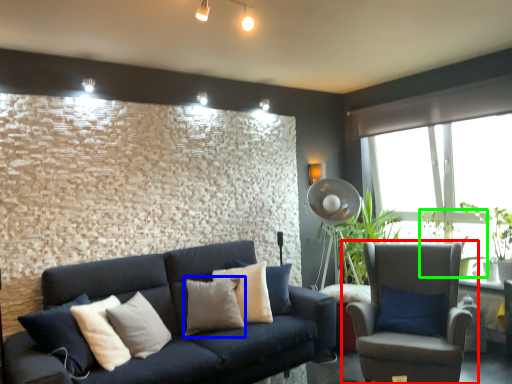
Question: Considering the real-world distances, which object is farthest from chair (highlighted by a red box)? pillow (highlighted by a blue box) or plant (highlighted by a green box)?

Choices:
 (A) pillow
 (B) plant

Answer: (A)